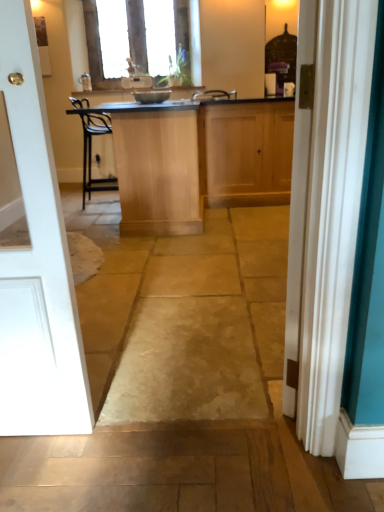
What are the coordinates of `vacant space that is in between teal fabric curtain at right and light wood/finely finished cabinet at center, placed as the second cabinetry when sorted from right to left` in the screenshot? It's located at (207, 269).